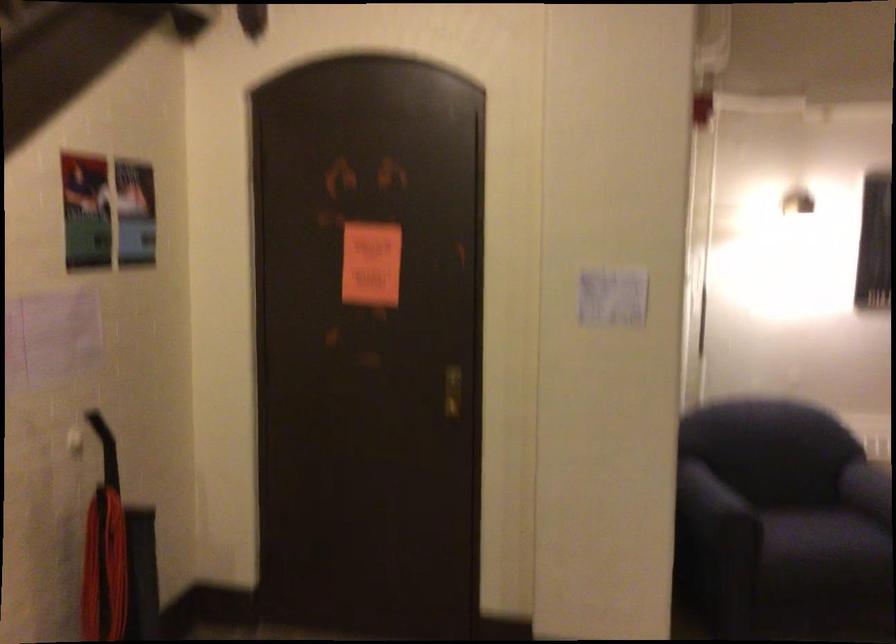
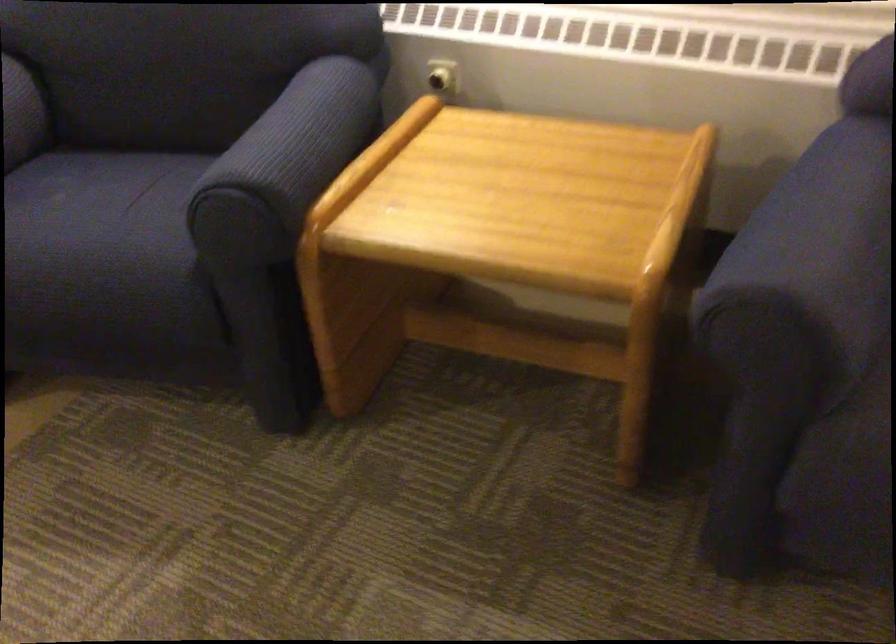
Where in the second image is the point corresponding to (820,529) from the first image?

(99, 232)